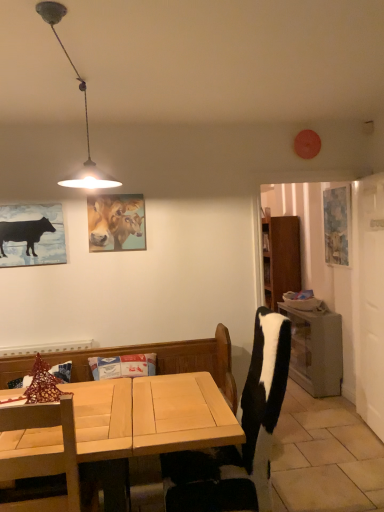
Question: Considering the relative sizes of wooden table at right and matte wooden picture frame at upper center, the 1th picture frame in the left-to-right sequence, in the image provided, is wooden table at right thinner than matte wooden picture frame at upper center, the 1th picture frame in the left-to-right sequence,?

Choices:
 (A) no
 (B) yes

Answer: (A)

Question: From the image's perspective, is wooden table at right beneath matte wooden picture frame at upper center, the 1th picture frame in the left-to-right sequence?

Choices:
 (A) no
 (B) yes

Answer: (B)

Question: Does wooden table at right lie behind matte wooden picture frame at upper center, the 2th picture frame positioned from the right?

Choices:
 (A) yes
 (B) no

Answer: (A)

Question: Would you consider wooden table at right to be distant from matte wooden picture frame at upper center, which is counted as the first picture frame, starting from the front?

Choices:
 (A) yes
 (B) no

Answer: (A)

Question: Does wooden table at right come in front of matte wooden picture frame at upper center, which is counted as the first picture frame, starting from the front?

Choices:
 (A) no
 (B) yes

Answer: (A)

Question: Is wooden table at right smaller than matte wooden picture frame at upper center, the 2th picture frame positioned from the right?

Choices:
 (A) yes
 (B) no

Answer: (B)

Question: From the image's perspective, is black matte cow at left on wooden table at right?

Choices:
 (A) no
 (B) yes

Answer: (B)

Question: Does black matte cow at left contain wooden table at right?

Choices:
 (A) no
 (B) yes

Answer: (A)

Question: Is black matte cow at left turned away from wooden table at right?

Choices:
 (A) yes
 (B) no

Answer: (B)

Question: From a real-world perspective, is black matte cow at left beneath wooden table at right?

Choices:
 (A) no
 (B) yes

Answer: (A)

Question: Is black matte cow at left far from wooden table at right?

Choices:
 (A) yes
 (B) no

Answer: (A)

Question: Can you confirm if black matte cow at left is taller than wooden table at right?

Choices:
 (A) no
 (B) yes

Answer: (A)

Question: From a real-world perspective, does black matte cow at left sit lower than light wood desk at lower left?

Choices:
 (A) no
 (B) yes

Answer: (A)